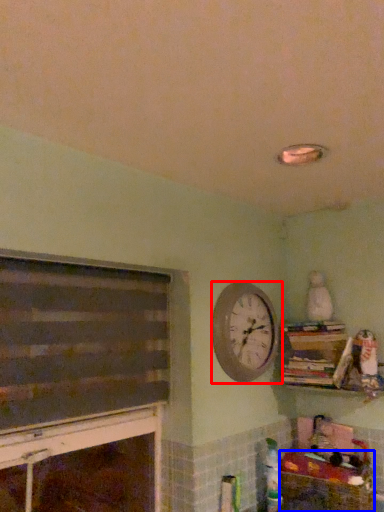
Question: Which of the following is the closest to the observer, wall clock (highlighted by a red box) or crate (highlighted by a blue box)?

Choices:
 (A) wall clock
 (B) crate

Answer: (B)